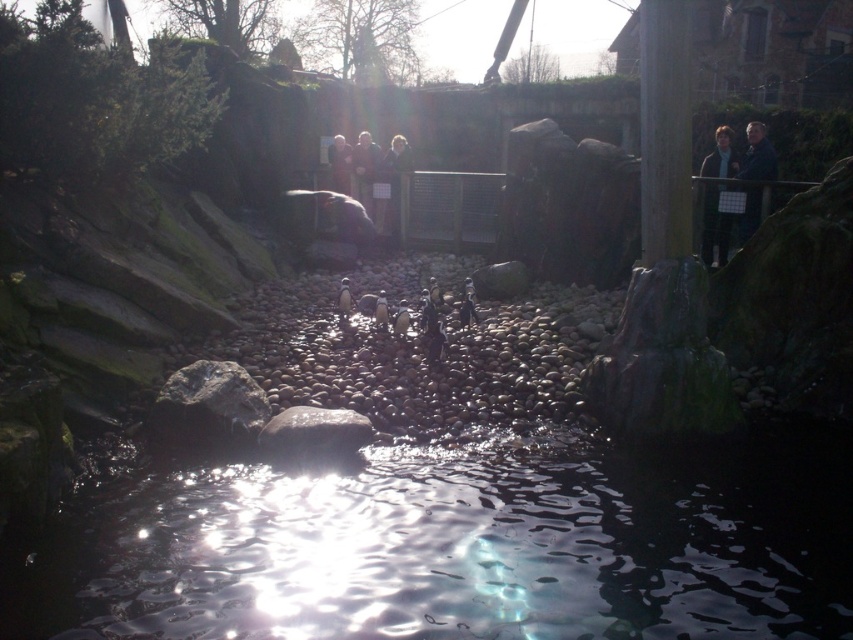
You are a zookeeper tasked with cleaning the rocky pathway in the penguin enclosure. You notice two items at the center of the path that need to be removed before the penguins return. The items are the dark brown leather jacket at center and the dark brown fur at center. Which item should you move first to ensure the penguins have enough space to walk comfortably?

The dark brown leather jacket at center is larger in size than the dark brown fur at center, so you should move the dark brown leather jacket at center first to ensure the penguins have enough space to walk comfortably.